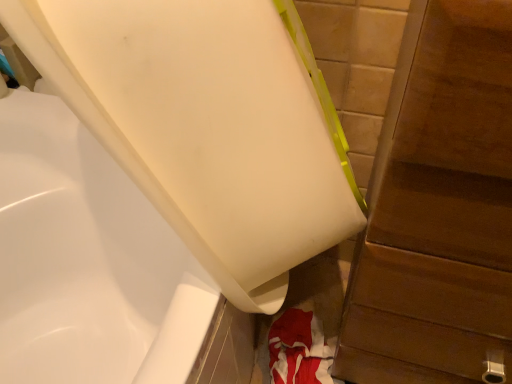
Question: Would you say white glossy bathtub at lower left is to the left or to the right of wooden dresser at right in the picture?

Choices:
 (A) right
 (B) left

Answer: (B)

Question: Is white glossy bathtub at lower left taller or shorter than wooden dresser at right?

Choices:
 (A) short
 (B) tall

Answer: (A)

Question: From the image's perspective, is white glossy bathtub at lower left located above or below wooden dresser at right?

Choices:
 (A) above
 (B) below

Answer: (A)

Question: From a real-world perspective, relative to white glossy bathtub at lower left, is wooden dresser at right vertically above or below?

Choices:
 (A) above
 (B) below

Answer: (B)

Question: Is point (387, 297) closer or farther from the camera than point (233, 188)?

Choices:
 (A) closer
 (B) farther

Answer: (B)

Question: From the image's perspective, is wooden dresser at right located above or below white glossy bathtub at lower left?

Choices:
 (A) below
 (B) above

Answer: (A)

Question: In the image, is wooden dresser at right on the left side or the right side of white glossy bathtub at lower left?

Choices:
 (A) left
 (B) right

Answer: (B)